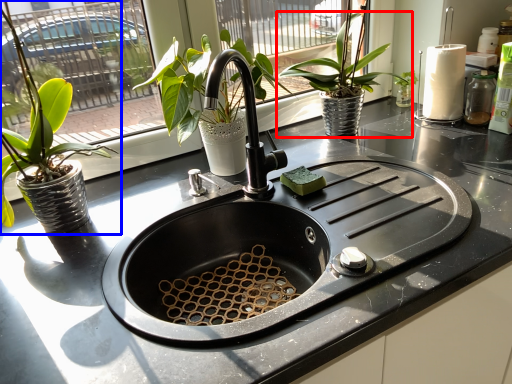
Question: Which object appears farthest to the camera in this image, houseplant (highlighted by a red box) or houseplant (highlighted by a blue box)?

Choices:
 (A) houseplant
 (B) houseplant

Answer: (A)